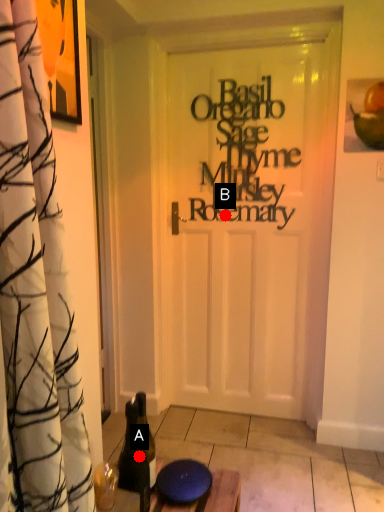
Question: Two points are circled on the image, labeled by A and B beside each circle. Among these points, which one is farthest from the camera?

Choices:
 (A) A is further
 (B) B is further

Answer: (B)